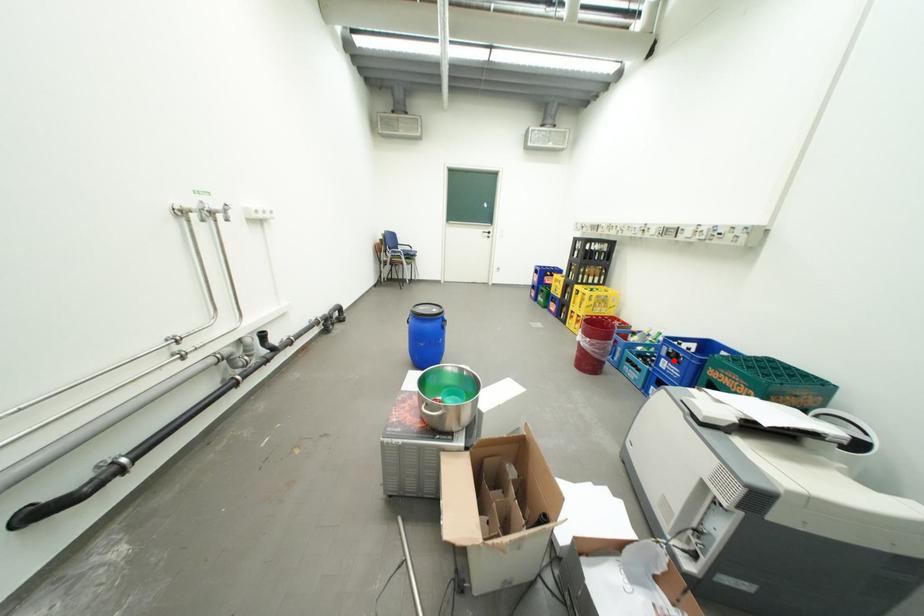
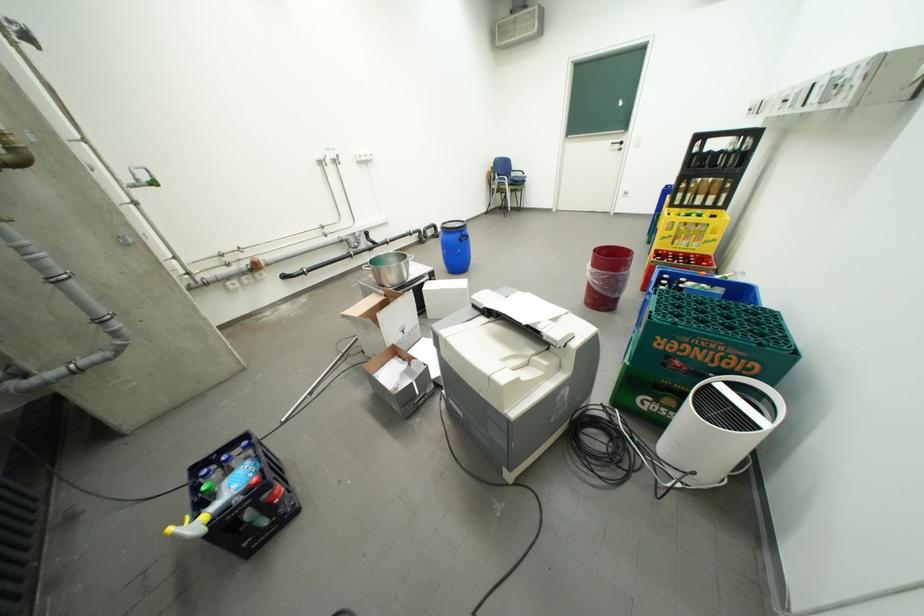
Question: I am providing you with two images of the same scene from different viewpoints. A red point is marked on the first image. Can you still see the location of the red point in image 2?

Choices:
 (A) Yes
 (B) No

Answer: (B)